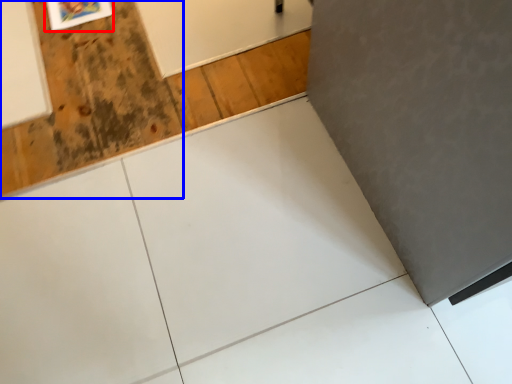
Question: Which object is closer to the camera taking this photo, picture frame (highlighted by a red box) or plywood (highlighted by a blue box)?

Choices:
 (A) picture frame
 (B) plywood

Answer: (B)